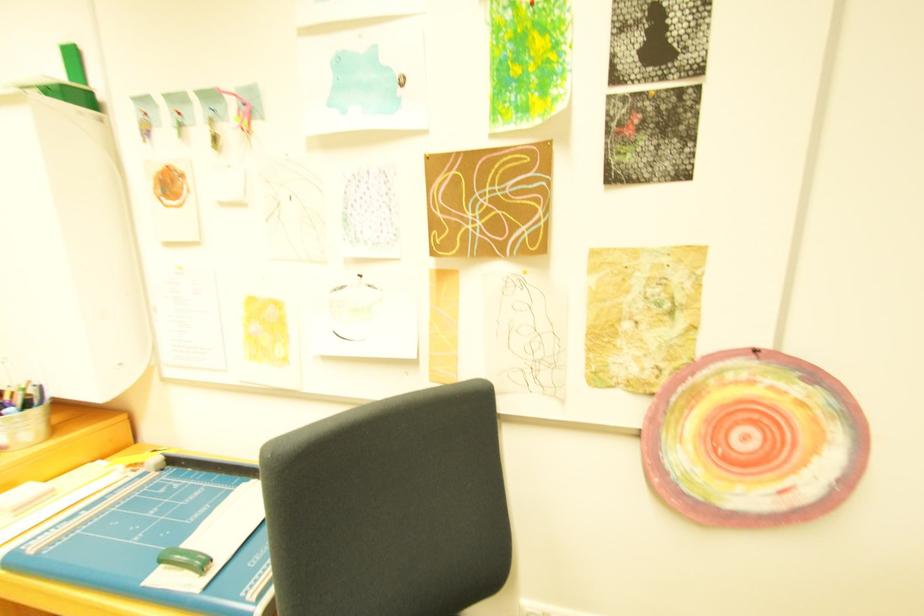
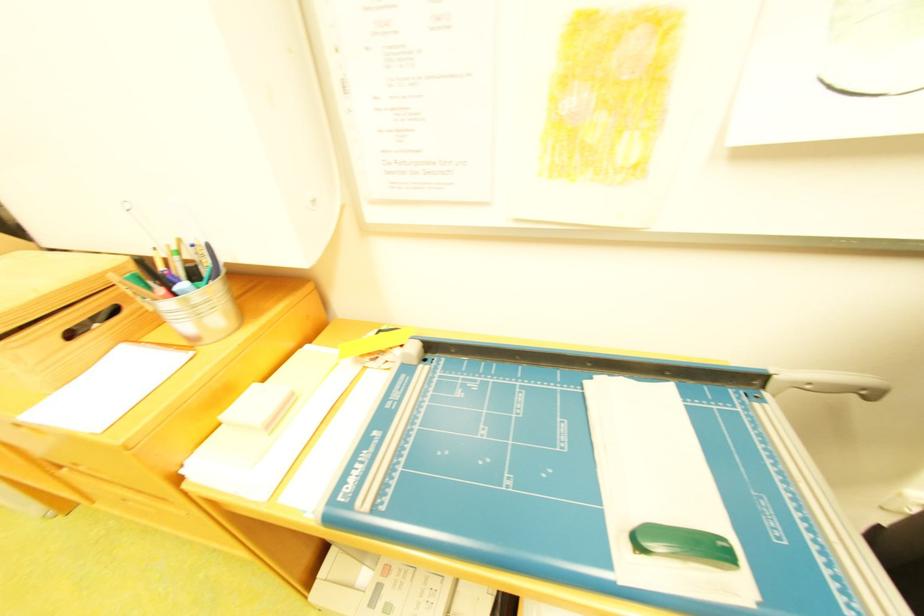
Question: How did the camera likely rotate?

Choices:
 (A) Left
 (B) Right
 (C) Up
 (D) Down

Answer: (D)